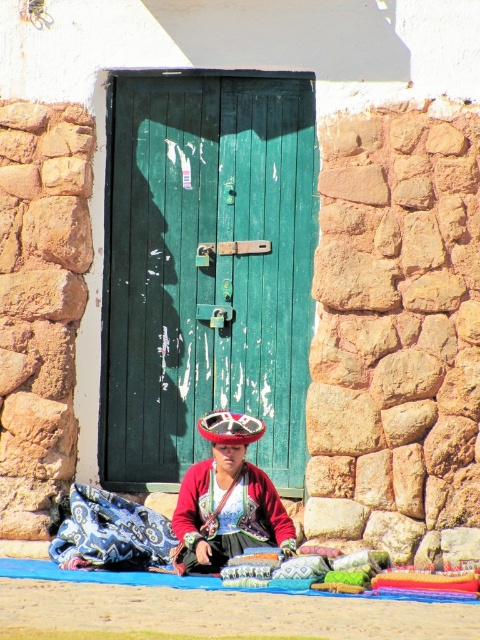
You are a photographer setting up a shot of the woman in the scene. You need to ensure that the embroidered fabric dress at center and the shiny metallic hat at center are both visible in the frame. Based on their sizes, which object should you prioritize positioning closer to the camera to ensure it doesn

The embroidered fabric dress at center might be wider than shiny metallic hat at center, so to ensure both are visible, prioritize positioning the shiny metallic hat at center closer to the camera since it is smaller and requires less space.